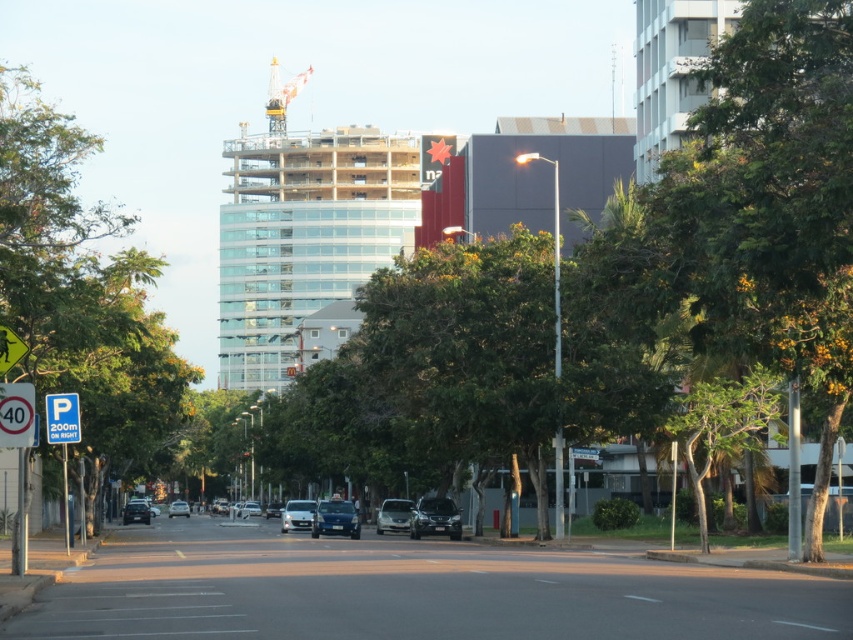
Which is behind, point (434, 516) or point (146, 520)?

Positioned behind is point (146, 520).

Can you confirm if satin black car at center is positioned below matte black car at center?

No, satin black car at center is not below matte black car at center.

The height and width of the screenshot is (640, 853). What do you see at coordinates (434, 518) in the screenshot?
I see `satin black car at center` at bounding box center [434, 518].

Image resolution: width=853 pixels, height=640 pixels. Identify the location of satin black car at center. (434, 518).

Does matte black car at center have a greater height compared to satin silver sedan at center?

No.

Locate an element on the screen. The height and width of the screenshot is (640, 853). matte black car at center is located at coordinates (136, 513).

Can you confirm if satin black car at center is positioned above yellow metallic crane at upper center?

Incorrect, satin black car at center is not positioned above yellow metallic crane at upper center.

I want to click on satin black car at center, so 434,518.

Is point (459, 513) positioned in front of point (285, 99)?

Yes, it is.

The width and height of the screenshot is (853, 640). Identify the location of satin black car at center. (434, 518).